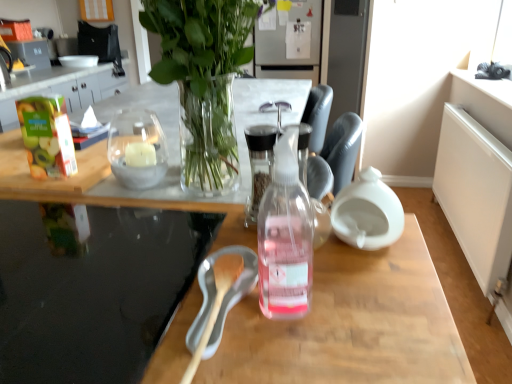
Identify the location of free space in front of clear glass bottle at center. click(x=286, y=351).